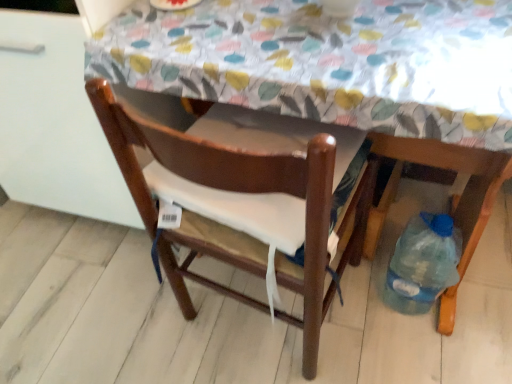
Question: Is wooden table at center thinner than brown wooden chair at center, which is the second chair in right-to-left order?

Choices:
 (A) no
 (B) yes

Answer: (B)

Question: Is wooden table at center wider than brown wooden chair at center, which is the 1th chair from left to right?

Choices:
 (A) no
 (B) yes

Answer: (A)

Question: Does wooden table at center touch brown wooden chair at center, which is the 1th chair from left to right?

Choices:
 (A) no
 (B) yes

Answer: (A)

Question: Is wooden table at center positioned with its back to brown wooden chair at center, which is the 1th chair from left to right?

Choices:
 (A) yes
 (B) no

Answer: (B)

Question: Does wooden table at center have a greater height compared to brown wooden chair at center, which is the second chair in right-to-left order?

Choices:
 (A) yes
 (B) no

Answer: (A)

Question: Is translucent plastic bottle at lower right, which appears as the 2th chair when viewed from the left, in front of or behind wooden table at center in the image?

Choices:
 (A) front
 (B) behind

Answer: (B)

Question: From their relative heights in the image, would you say translucent plastic bottle at lower right, which ranks as the first chair in right-to-left order, is taller or shorter than wooden table at center?

Choices:
 (A) tall
 (B) short

Answer: (B)

Question: From a real-world perspective, relative to wooden table at center, is translucent plastic bottle at lower right, which ranks as the first chair in right-to-left order, vertically above or below?

Choices:
 (A) below
 (B) above

Answer: (A)

Question: Visually, is translucent plastic bottle at lower right, which appears as the 2th chair when viewed from the left, positioned to the left or to the right of wooden table at center?

Choices:
 (A) right
 (B) left

Answer: (A)

Question: Is wooden table at center bigger or smaller than brown wooden chair at center, which is the second chair in right-to-left order?

Choices:
 (A) small
 (B) big

Answer: (B)

Question: In the image, is wooden table at center on the left side or the right side of brown wooden chair at center, which is the 1th chair from left to right?

Choices:
 (A) right
 (B) left

Answer: (A)

Question: Does point (435, 99) appear closer or farther from the camera than point (256, 208)?

Choices:
 (A) farther
 (B) closer

Answer: (B)

Question: From a real-world perspective, is wooden table at center positioned above or below brown wooden chair at center, which is the second chair in right-to-left order?

Choices:
 (A) above
 (B) below

Answer: (A)

Question: Based on their sizes in the image, would you say brown wooden chair at center, which is the second chair in right-to-left order, is bigger or smaller than translucent plastic bottle at lower right, which appears as the 2th chair when viewed from the left?

Choices:
 (A) small
 (B) big

Answer: (B)

Question: Considering the positions of brown wooden chair at center, which is the second chair in right-to-left order, and translucent plastic bottle at lower right, which ranks as the first chair in right-to-left order, in the image, is brown wooden chair at center, which is the second chair in right-to-left order, wider or thinner than translucent plastic bottle at lower right, which ranks as the first chair in right-to-left order,?

Choices:
 (A) wide
 (B) thin

Answer: (A)